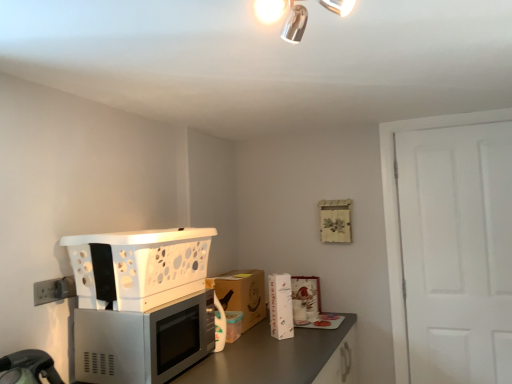
Question: Considering the relative sizes of metallic gray countertop at lower center and white matte door at right in the image provided, is metallic gray countertop at lower center smaller than white matte door at right?

Choices:
 (A) no
 (B) yes

Answer: (A)

Question: Is metallic gray countertop at lower center wider than white matte door at right?

Choices:
 (A) yes
 (B) no

Answer: (A)

Question: Is metallic gray countertop at lower center turned away from white matte door at right?

Choices:
 (A) no
 (B) yes

Answer: (A)

Question: Is metallic gray countertop at lower center in contact with white matte door at right?

Choices:
 (A) yes
 (B) no

Answer: (B)

Question: Is metallic gray countertop at lower center taller than white matte door at right?

Choices:
 (A) yes
 (B) no

Answer: (B)

Question: From a real-world perspective, is metallic gray countertop at lower center under white matte door at right?

Choices:
 (A) no
 (B) yes

Answer: (B)

Question: From a real-world perspective, is brown cardboard box at center on top of satin silver microwave at lower left?

Choices:
 (A) yes
 (B) no

Answer: (B)

Question: Is brown cardboard box at center taller than satin silver microwave at lower left?

Choices:
 (A) no
 (B) yes

Answer: (B)

Question: Is satin silver microwave at lower left surrounded by brown cardboard box at center?

Choices:
 (A) no
 (B) yes

Answer: (A)

Question: Does brown cardboard box at center come in front of satin silver microwave at lower left?

Choices:
 (A) no
 (B) yes

Answer: (A)

Question: Considering the relative positions of brown cardboard box at center and satin silver microwave at lower left in the image provided, is brown cardboard box at center to the right of satin silver microwave at lower left from the viewer's perspective?

Choices:
 (A) yes
 (B) no

Answer: (A)

Question: Considering the relative sizes of brown cardboard box at center and satin silver microwave at lower left in the image provided, is brown cardboard box at center thinner than satin silver microwave at lower left?

Choices:
 (A) no
 (B) yes

Answer: (B)

Question: Is metallic chrome light fixture at upper center shorter than metallic gray countertop at lower center?

Choices:
 (A) no
 (B) yes

Answer: (B)